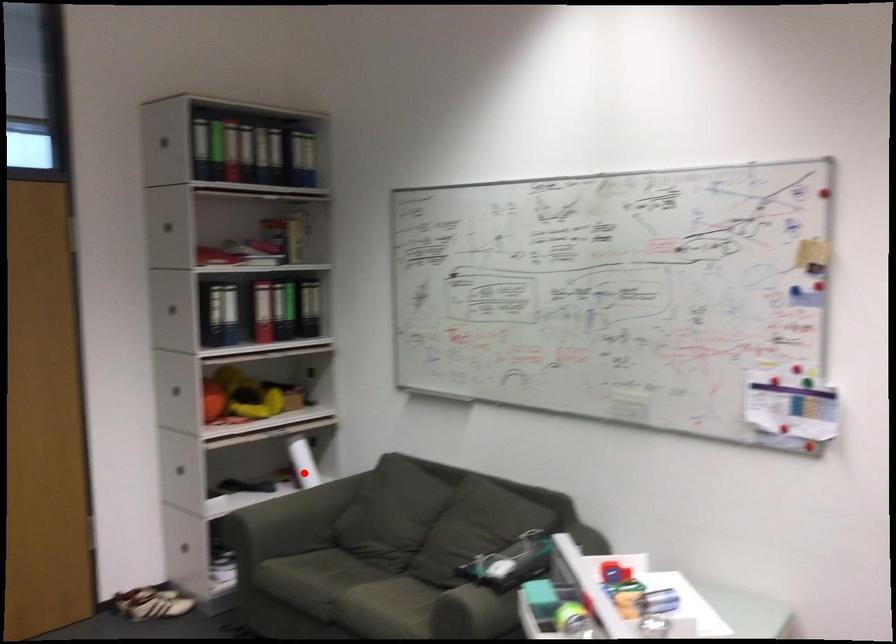
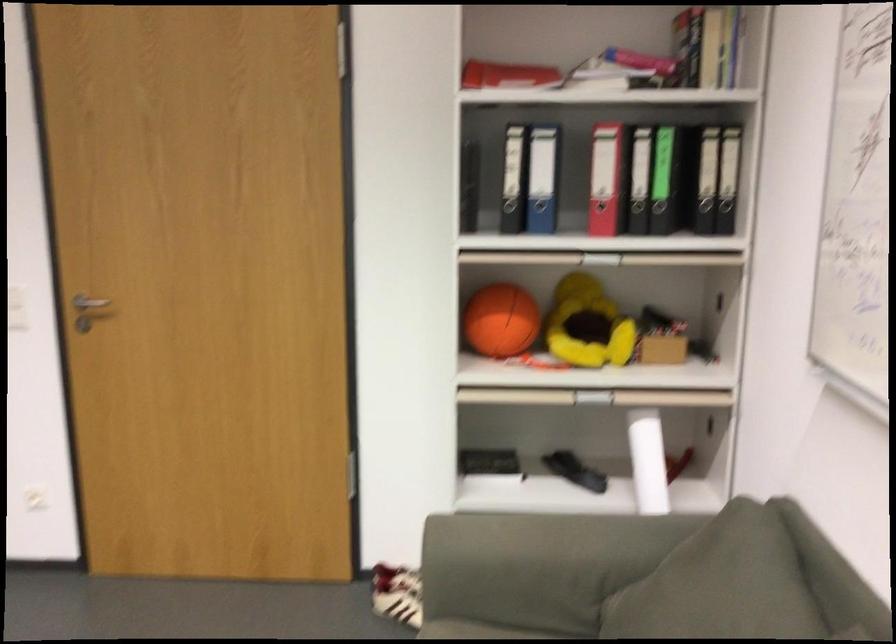
Question: I am providing you with two images of the same scene from different viewpoints. A red point is shown in image1. For the corresponding object point in image2, is it positioned nearer or farther from the camera?

Choices:
 (A) Nearer
 (B) Farther

Answer: (A)